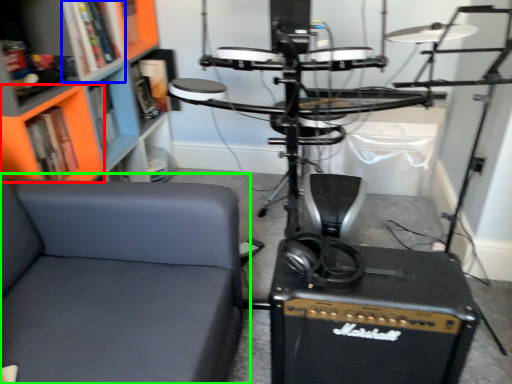
Question: Considering the real-world distances, which object is closest to shelf (highlighted by a red box)? shelf (highlighted by a blue box) or chair (highlighted by a green box).

Choices:
 (A) shelf
 (B) chair

Answer: (A)